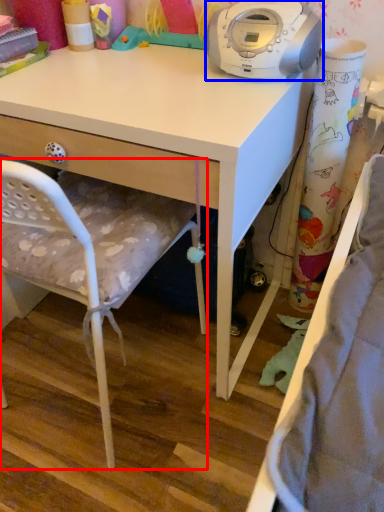
Question: Which point is further to the camera, chair (highlighted by a red box) or home appliance (highlighted by a blue box)?

Choices:
 (A) chair
 (B) home appliance

Answer: (B)